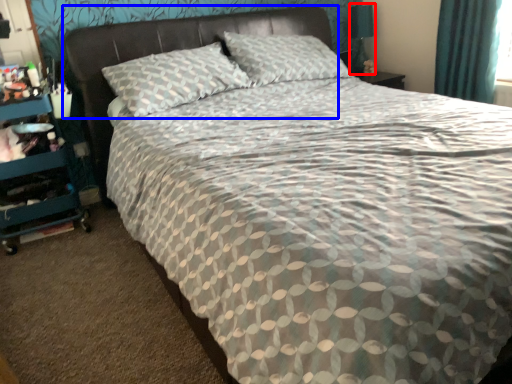
Question: Among these objects, which one is nearest to the camera, table lamp (highlighted by a red box) or headboard (highlighted by a blue box)?

Choices:
 (A) table lamp
 (B) headboard

Answer: (B)